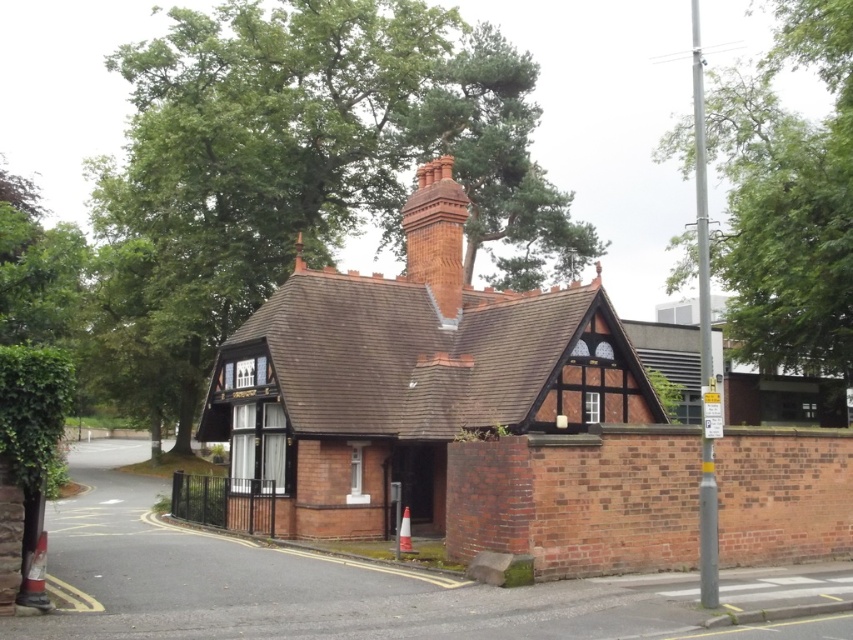
Question: Considering the relative positions of green leafy tree at upper center and red brick chimney at upper center in the image provided, where is green leafy tree at upper center located with respect to red brick chimney at upper center?

Choices:
 (A) left
 (B) right

Answer: (A)

Question: Which of the following is the farthest from the observer?

Choices:
 (A) (737, 100)
 (B) (509, 147)
 (C) (444, 202)

Answer: (B)

Question: Which point appears farthest from the camera in this image?

Choices:
 (A) (256, 150)
 (B) (817, 141)

Answer: (A)

Question: Considering the real-world distances, which object is closest to the green leafy tree at upper center?

Choices:
 (A) green leafy tree at right
 (B) red brick chimney at upper center

Answer: (B)

Question: Can you confirm if green leafy tree at upper center is wider than red brick chimney at upper center?

Choices:
 (A) no
 (B) yes

Answer: (B)

Question: From the image, what is the correct spatial relationship of green leafy tree at right in relation to red brick chimney at upper center?

Choices:
 (A) above
 (B) below

Answer: (A)